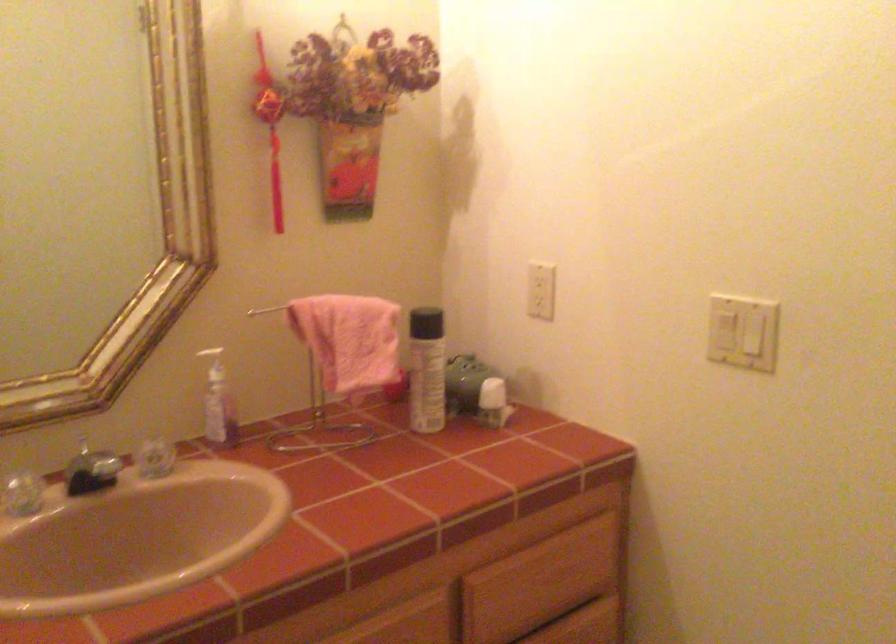
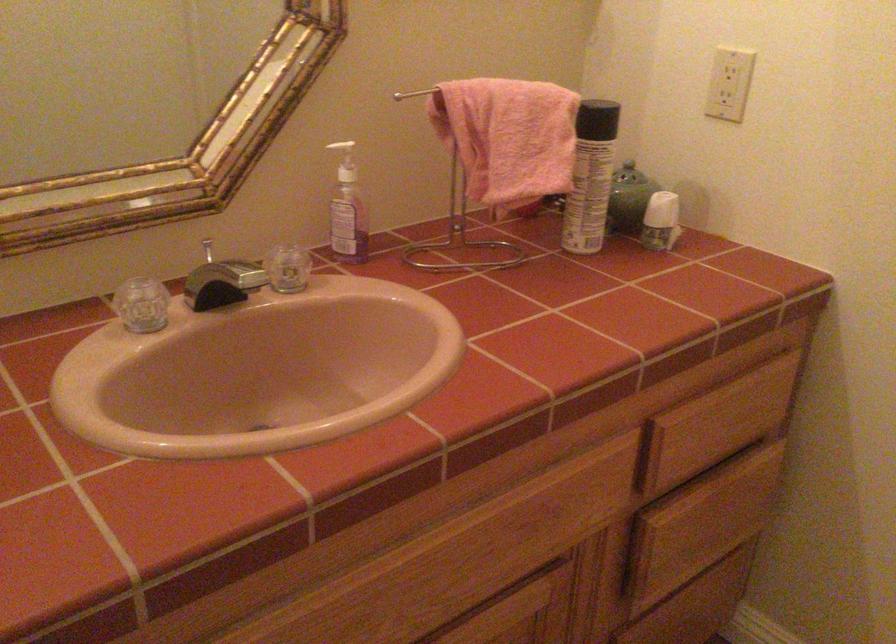
Locate, in the second image, the point that corresponds to pixel 211 366 in the first image.

(345, 161)